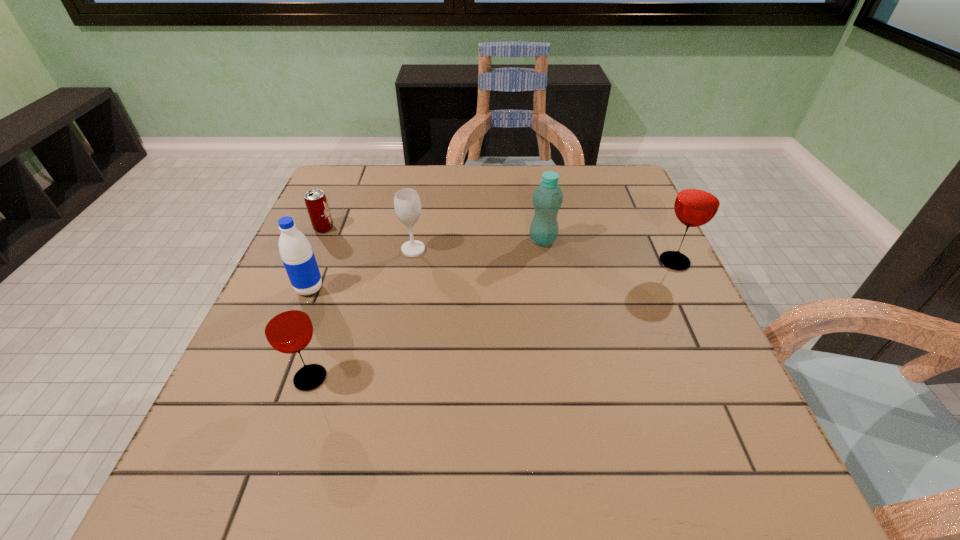
To make them evenly spaced by inserting another glass_(drink_container) among them, please locate a vacant spot for this new glass_(drink_container). Please provide its 2D coordinates. Your answer should be formatted as a tuple, i.e. [(x, y)], where the tuple contains the x and y coordinates of a point satisfying the conditions above.

[(516, 313)]